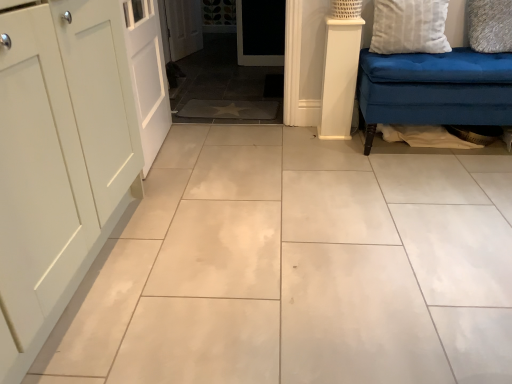
Question: Looking at their shapes, would you say white smooth column at right is wider or thinner than white painted wood door at left?

Choices:
 (A) thin
 (B) wide

Answer: (B)

Question: From the image's perspective, is white smooth column at right above or below white painted wood door at left?

Choices:
 (A) above
 (B) below

Answer: (A)

Question: Which is farther from the white smooth column at right?

Choices:
 (A) white painted wood door at left
 (B) white textured pillow at upper right, which ranks as the second pillow in left-to-right order
 (C) white textured pillow at upper right, arranged as the 2th pillow when viewed from the right

Answer: (A)

Question: Which object is the farthest from the white textured pillow at upper right, the 1th pillow positioned from the left?

Choices:
 (A) white textured pillow at upper right, positioned as the 1th pillow in right-to-left order
 (B) white painted wood door at left
 (C) white smooth column at right

Answer: (B)